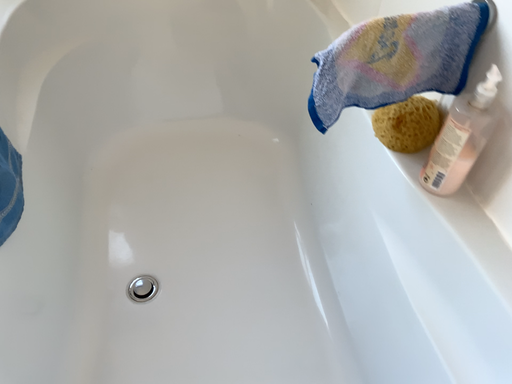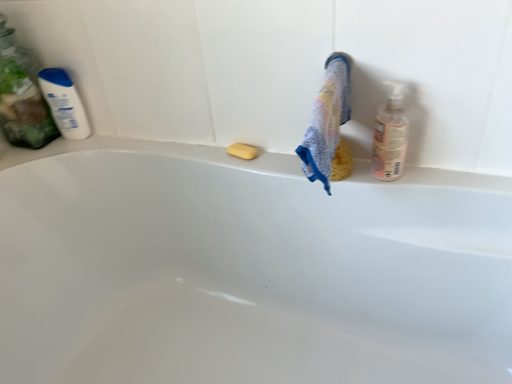
Question: How did the camera likely rotate when shooting the video?

Choices:
 (A) rotated upward
 (B) rotated downward

Answer: (A)